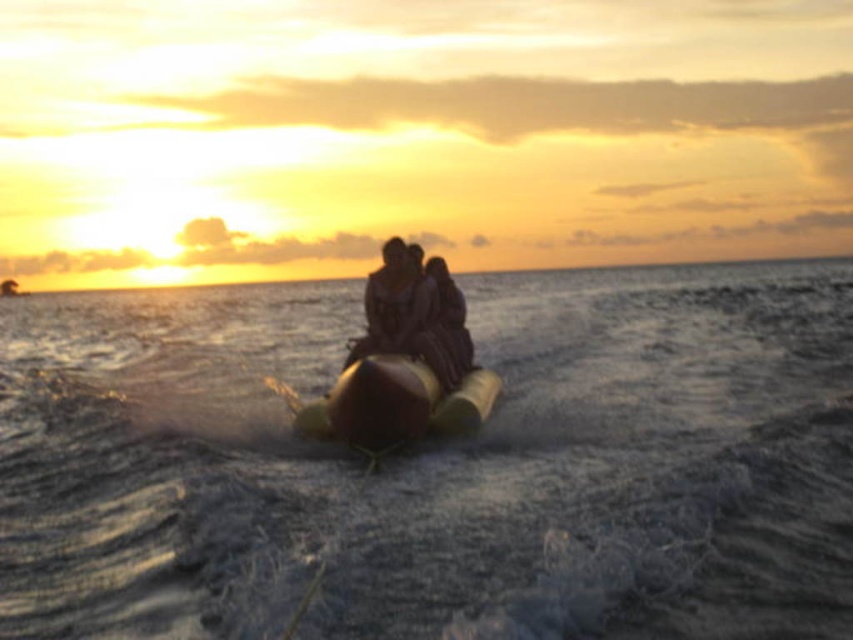
Looking at this image, you are standing on the beach and want to take a photo of the banana boat ride. The camera you are using has a zoom lens that can focus on a specific point. The scene includes a banana boat and a point labeled as point (x=436, y=465). Where should you aim your camera to capture the translucent rubber water at center?

You should aim your camera at point (x=436, y=465) to capture the translucent rubber water at center as it is located there.

You are a photographer trying to capture the banana boat in the sunset scene. The boat is moving towards the point at coordinates point (436, 465). Based on the scene description, where should you position your camera to ensure the boat stays in frame as it moves towards that point?

The translucent rubber water at center is located at point (436, 465), so you should position your camera facing towards the center of the scene where the translucent rubber water at center is located to capture the boat moving towards that point.